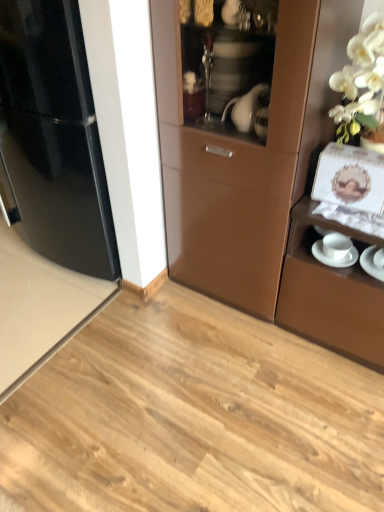
Describe the element at coordinates (54, 137) in the screenshot. I see `glossy black refrigerator at left` at that location.

How much space does white glossy saucer at lower right, the first saucer in the right-to-left sequence, occupy vertically?

0.69 inches.

Identify the location of glossy black refrigerator at left. This screenshot has height=512, width=384. click(x=54, y=137).

Is glossy black refrigerator at left a part of white glossy saucer at right, which ranks as the 1th saucer in left-to-right order?

No, glossy black refrigerator at left is located outside of white glossy saucer at right, which ranks as the 1th saucer in left-to-right order.

Looking at the image, does white glossy saucer at right, which is the second saucer from right to left, seem bigger or smaller compared to glossy black refrigerator at left?

Clearly, white glossy saucer at right, which is the second saucer from right to left, is smaller in size than glossy black refrigerator at left.

Considering the sizes of objects white glossy saucer at right, which ranks as the 1th saucer in left-to-right order, and glossy black refrigerator at left in the image provided, who is taller, white glossy saucer at right, which ranks as the 1th saucer in left-to-right order, or glossy black refrigerator at left?

glossy black refrigerator at left is taller.

Locate an element on the screen. refrigerator behind the white glossy saucer at right, which ranks as the 1th saucer in left-to-right order is located at coordinates (54, 137).

From the image's perspective, is white glossy saucer at right, which is the second saucer from right to left, below white glossy saucer at lower right, marked as the second saucer in a left-to-right arrangement?

No, from the image's perspective, white glossy saucer at right, which is the second saucer from right to left, is not below white glossy saucer at lower right, marked as the second saucer in a left-to-right arrangement.

In the image, is white glossy saucer at right, which ranks as the 1th saucer in left-to-right order, positioned in front of or behind white glossy saucer at lower right, the first saucer in the right-to-left sequence?

Clearly, white glossy saucer at right, which ranks as the 1th saucer in left-to-right order, is behind white glossy saucer at lower right, the first saucer in the right-to-left sequence.

Between point (321, 253) and point (366, 269), which one is positioned in front?

Point (366, 269)

Is white glossy saucer at right, which ranks as the 1th saucer in left-to-right order, positioned beyond the bounds of white glossy saucer at lower right, the first saucer in the right-to-left sequence?

white glossy saucer at right, which ranks as the 1th saucer in left-to-right order, is positioned outside white glossy saucer at lower right, the first saucer in the right-to-left sequence.

Which object is wider, white glossy saucer at lower right, the first saucer in the right-to-left sequence, or glossy black refrigerator at left?

Wider between the two is glossy black refrigerator at left.

Considering the relative sizes of white glossy saucer at lower right, the first saucer in the right-to-left sequence, and glossy black refrigerator at left in the image provided, is white glossy saucer at lower right, the first saucer in the right-to-left sequence, shorter than glossy black refrigerator at left?

Correct, white glossy saucer at lower right, the first saucer in the right-to-left sequence, is not as tall as glossy black refrigerator at left.

From a real-world perspective, which is physically below, white glossy saucer at lower right, the first saucer in the right-to-left sequence, or glossy black refrigerator at left?

white glossy saucer at lower right, the first saucer in the right-to-left sequence, is physically lower.

This screenshot has height=512, width=384. Find the location of `saucer that is the 2nd one when counting forward from the glossy black refrigerator at left`. saucer that is the 2nd one when counting forward from the glossy black refrigerator at left is located at coordinates (371, 263).

Is glossy black refrigerator at left positioned with its back to white glossy saucer at right, which ranks as the 1th saucer in left-to-right order?

No, glossy black refrigerator at left is not facing the opposite direction of white glossy saucer at right, which ranks as the 1th saucer in left-to-right order.

Is glossy black refrigerator at left at the right side of white glossy saucer at right, which ranks as the 1th saucer in left-to-right order?

No, glossy black refrigerator at left is not to the right of white glossy saucer at right, which ranks as the 1th saucer in left-to-right order.

From a real-world perspective, is glossy black refrigerator at left on top of white glossy saucer at right, which is the second saucer from right to left?

Correct, in the physical world, glossy black refrigerator at left is higher than white glossy saucer at right, which is the second saucer from right to left.

Between point (369, 265) and point (329, 261), which one is positioned in front?

The point (369, 265) is closer.

From a real-world perspective, which object rests below the other?

In real-world perspective, white glossy saucer at right, which is the second saucer from right to left, is lower.

How different are the orientations of white glossy saucer at lower right, marked as the second saucer in a left-to-right arrangement, and white glossy saucer at right, which ranks as the 1th saucer in left-to-right order, in degrees?

The facing directions of white glossy saucer at lower right, marked as the second saucer in a left-to-right arrangement, and white glossy saucer at right, which ranks as the 1th saucer in left-to-right order, are 0.000281 degrees apart.

Is white glossy saucer at lower right, the first saucer in the right-to-left sequence, with white glossy saucer at right, which ranks as the 1th saucer in left-to-right order?

Yes, white glossy saucer at lower right, the first saucer in the right-to-left sequence, is beside white glossy saucer at right, which ranks as the 1th saucer in left-to-right order.

Which object is positioned more to the left, glossy black refrigerator at left or white glossy saucer at lower right, marked as the second saucer in a left-to-right arrangement?

glossy black refrigerator at left is more to the left.

Is glossy black refrigerator at left facing away from white glossy saucer at lower right, the first saucer in the right-to-left sequence?

glossy black refrigerator at left does not have its back to white glossy saucer at lower right, the first saucer in the right-to-left sequence.

Which is closer to the camera, [92,273] or [370,262]?

Clearly, point [92,273] is more distant from the camera than point [370,262].

Locate an element on the screen. The image size is (384, 512). the 1st saucer below the glossy black refrigerator at left (from the image's perspective) is located at coordinates (334, 258).

Find the location of a particular element. This screenshot has width=384, height=512. saucer behind the white glossy saucer at lower right, marked as the second saucer in a left-to-right arrangement is located at coordinates (334, 258).

Based on their spatial positions, is white glossy saucer at lower right, the first saucer in the right-to-left sequence, or glossy black refrigerator at left further from white glossy saucer at right, which ranks as the 1th saucer in left-to-right order?

The object further to white glossy saucer at right, which ranks as the 1th saucer in left-to-right order, is glossy black refrigerator at left.

When comparing their distances from glossy black refrigerator at left, does white glossy saucer at right, which ranks as the 1th saucer in left-to-right order, or white glossy saucer at lower right, marked as the second saucer in a left-to-right arrangement, seem further?

Among the two, white glossy saucer at lower right, marked as the second saucer in a left-to-right arrangement, is located further to glossy black refrigerator at left.

Looking at the image, which one is located further to white glossy saucer at right, which ranks as the 1th saucer in left-to-right order, glossy black refrigerator at left or white glossy saucer at lower right, the first saucer in the right-to-left sequence?

glossy black refrigerator at left lies further to white glossy saucer at right, which ranks as the 1th saucer in left-to-right order, than the other object.

When comparing their distances from white glossy saucer at lower right, marked as the second saucer in a left-to-right arrangement, does white glossy saucer at right, which is the second saucer from right to left, or glossy black refrigerator at left seem closer?

Among the two, white glossy saucer at right, which is the second saucer from right to left, is located nearer to white glossy saucer at lower right, marked as the second saucer in a left-to-right arrangement.

From the image, which object appears to be nearer to white glossy saucer at lower right, marked as the second saucer in a left-to-right arrangement, glossy black refrigerator at left or white glossy saucer at right, which is the second saucer from right to left?

white glossy saucer at right, which is the second saucer from right to left, lies closer to white glossy saucer at lower right, marked as the second saucer in a left-to-right arrangement, than the other object.

When comparing their distances from glossy black refrigerator at left, does white glossy saucer at lower right, marked as the second saucer in a left-to-right arrangement, or white glossy saucer at right, which ranks as the 1th saucer in left-to-right order, seem further?

white glossy saucer at lower right, marked as the second saucer in a left-to-right arrangement.

Find the location of a particular element. The height and width of the screenshot is (512, 384). saucer between glossy black refrigerator at left and white glossy saucer at lower right, the first saucer in the right-to-left sequence is located at coordinates (x=334, y=258).